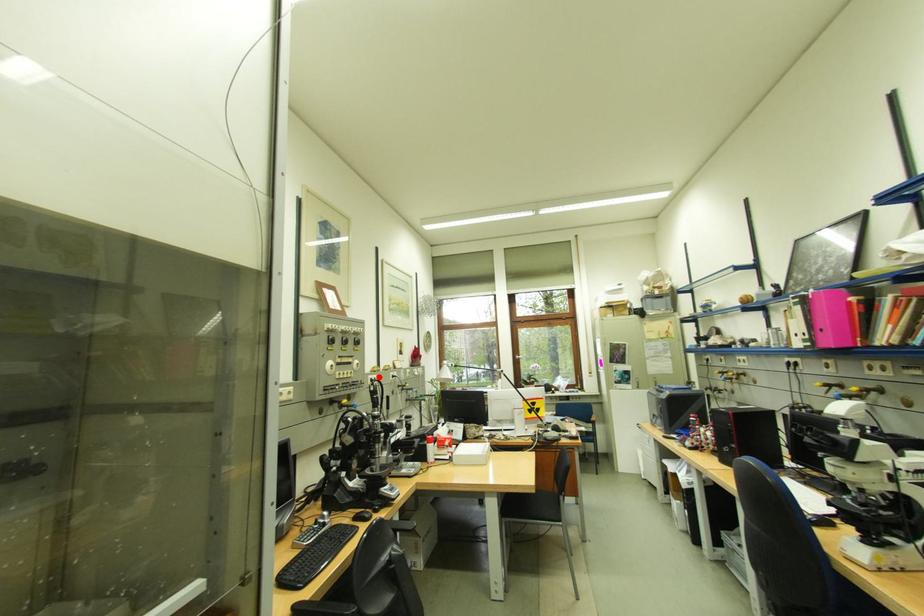
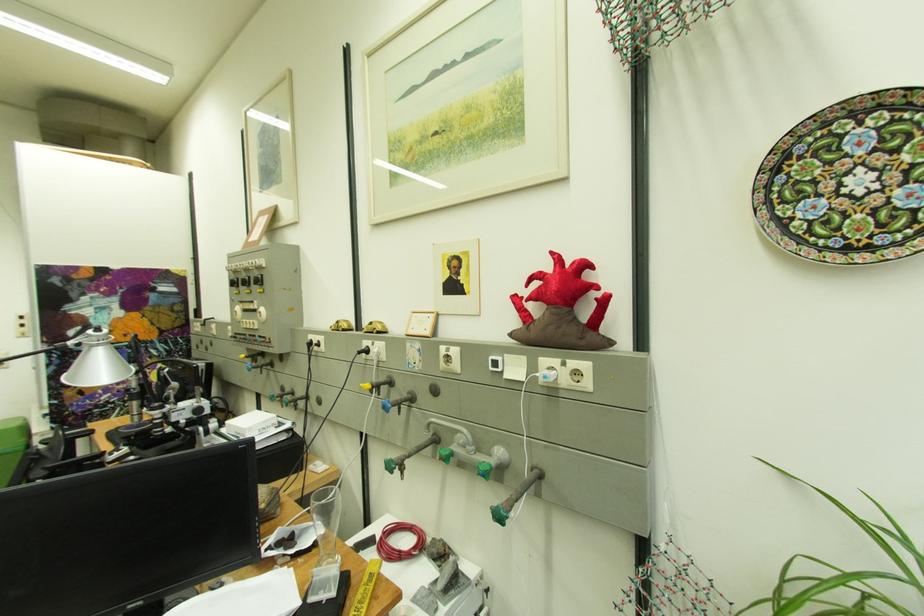
The point at the highlighted location is marked in the first image. Where is the corresponding point in the second image?

(320, 336)